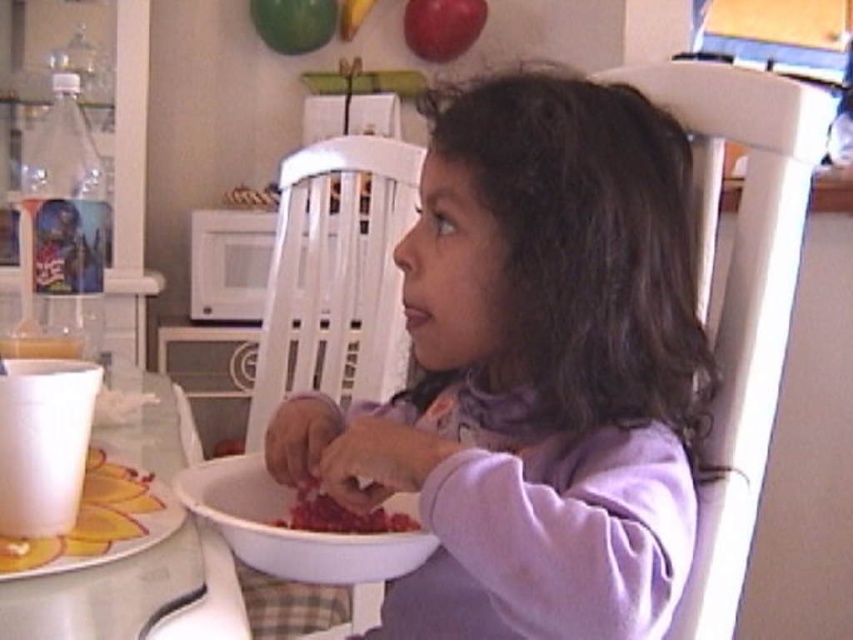
You are trying to place the white paper cup at lower left on the white plastic table at lower left. Will it fit on the table?

The white plastic table at lower left is wider than the white paper cup at lower left, so yes, the cup will fit on the table.

Based on the photo, you are a parent trying to ensure your child stays hydrated. You see the white plastic bowl at lower left and the red matte apple at upper center on the table. Which object is closer to the left edge of the table?

The white plastic bowl at lower left is positioned on the left side of the red matte apple at upper center, meaning it is closer to the left edge of the table.